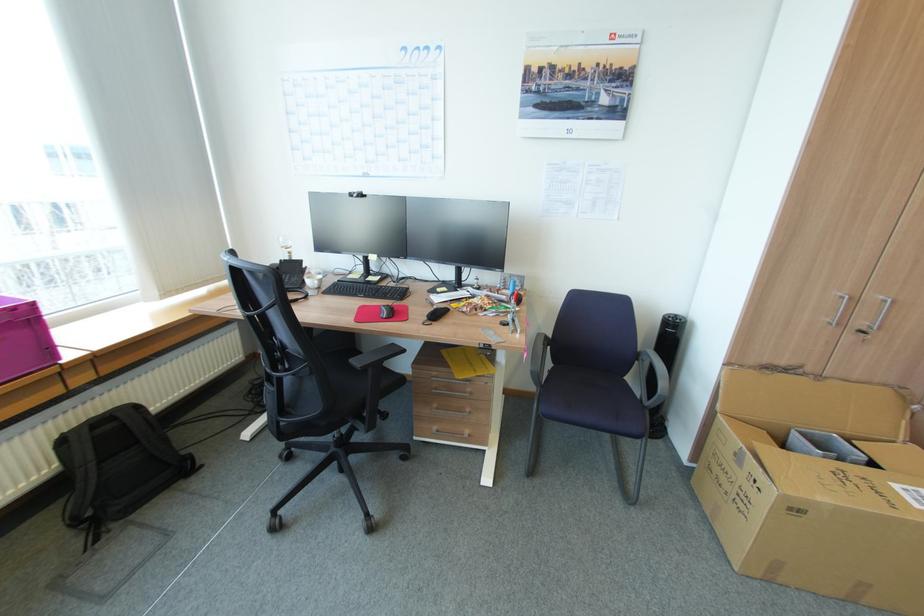
Which object does [386,310] point to?

It refers to a black computer mouse.